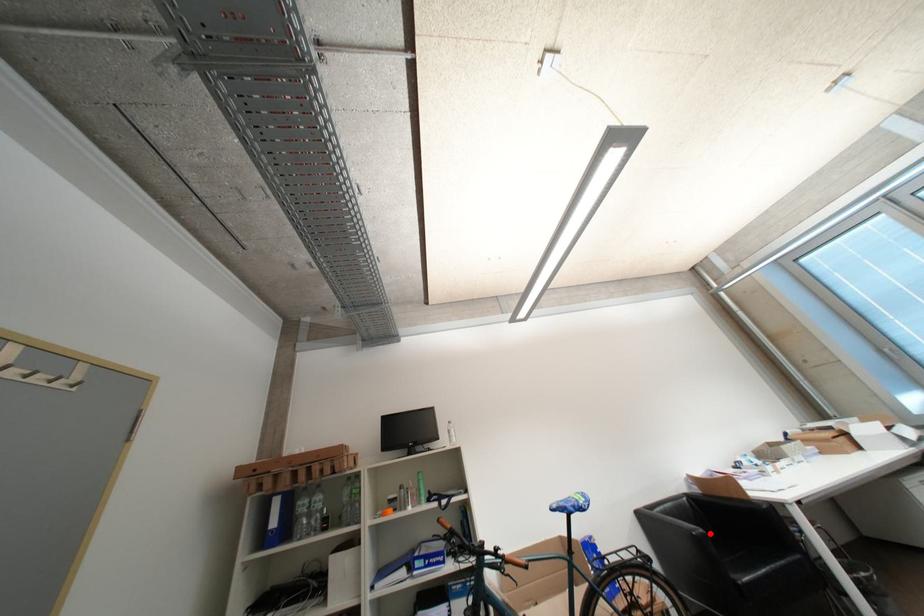
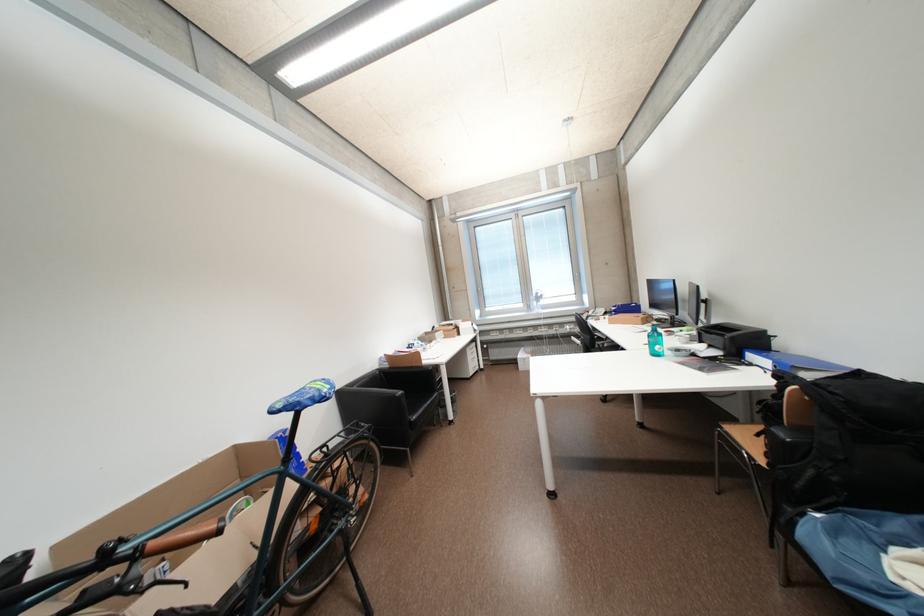
Question: I am providing you with two images of the same scene from different viewpoints. In image1, a red point is highlighted. Considering the same 3D point in image2, which of the following is correct?

Choices:
 (A) It is closer
 (B) It is farther

Answer: (B)